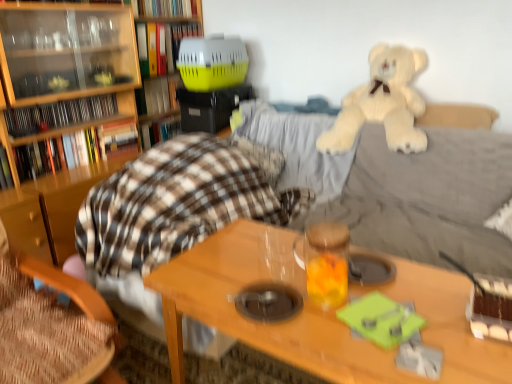
This screenshot has width=512, height=384. In order to click on vacant space behind translucent glass jar at center in this screenshot , I will do `click(290, 261)`.